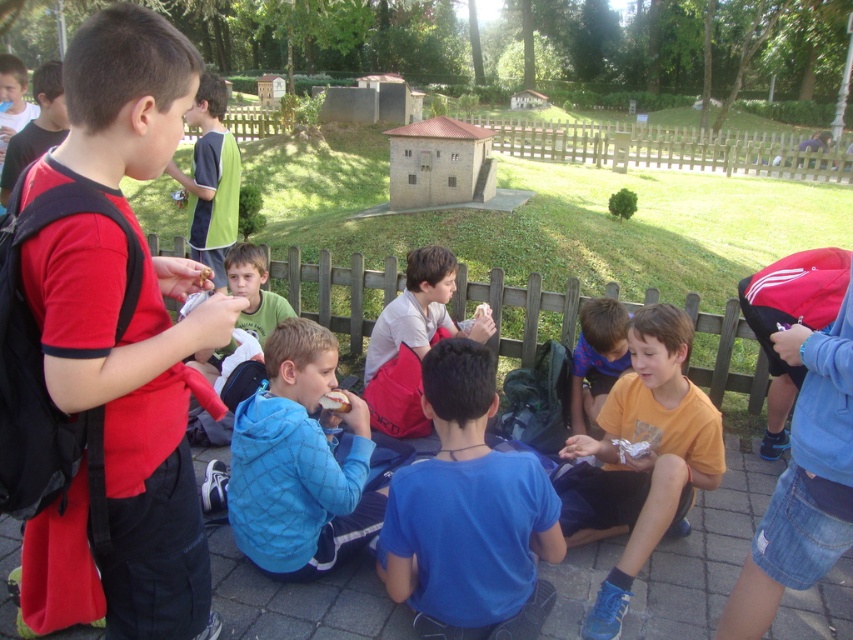
You are a photographer trying to capture a closeup of the red matte shirt at left. What are the exact coordinates where you should focus your camera?

The red matte shirt at left is located at point coordinates of (x=120, y=346).